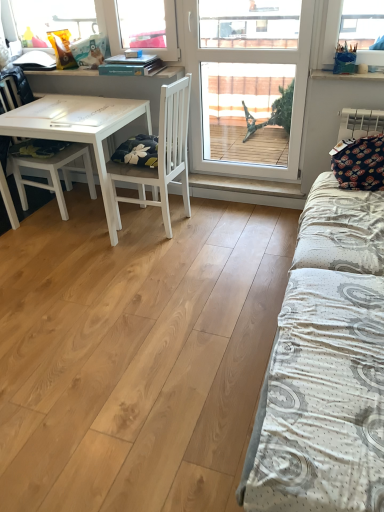
Locate an element on the screen. This screenshot has height=512, width=384. free space in front of white matte chair at center, arranged as the 1th chair when viewed from the right is located at coordinates (160, 253).